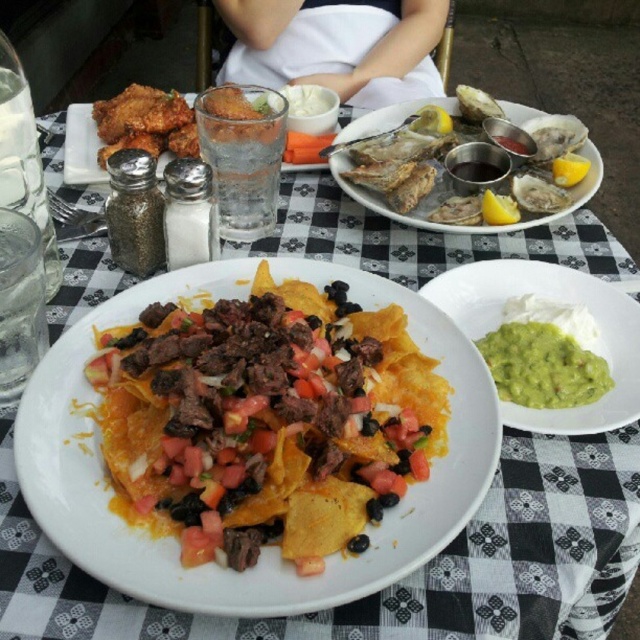
Question: Which is nearer to the green creamy guacamole at right?

Choices:
 (A) crunchy tortilla chips with cheese, meat, tomatoes, and black beans at center
 (B) shiny silver oysters at upper right

Answer: (A)

Question: Is crunchy tortilla chips with cheese, meat, tomatoes, and black beans at center thinner than shiny silver oysters at upper right?

Choices:
 (A) no
 (B) yes

Answer: (B)

Question: Can you confirm if crunchy tortilla chips with cheese, meat, tomatoes, and black beans at center is positioned to the right of green creamy guacamole at right?

Choices:
 (A) no
 (B) yes

Answer: (A)

Question: Can you confirm if crunchy tortilla chips with cheese, meat, tomatoes, and black beans at center is positioned below shiny silver oysters at upper right?

Choices:
 (A) no
 (B) yes

Answer: (B)

Question: Which point is closer to the camera taking this photo?

Choices:
 (A) (358, 188)
 (B) (545, 348)

Answer: (B)

Question: Which point is farther to the camera?

Choices:
 (A) crunchy tortilla chips with cheese, meat, tomatoes, and black beans at center
 (B) shiny silver oysters at upper right

Answer: (B)